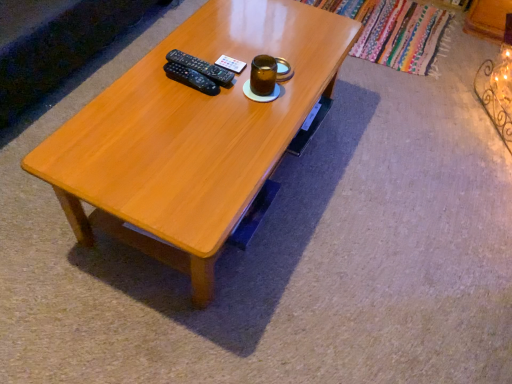
The width and height of the screenshot is (512, 384). I want to click on free space that is to the left of black plastic remote at center, so tap(145, 74).